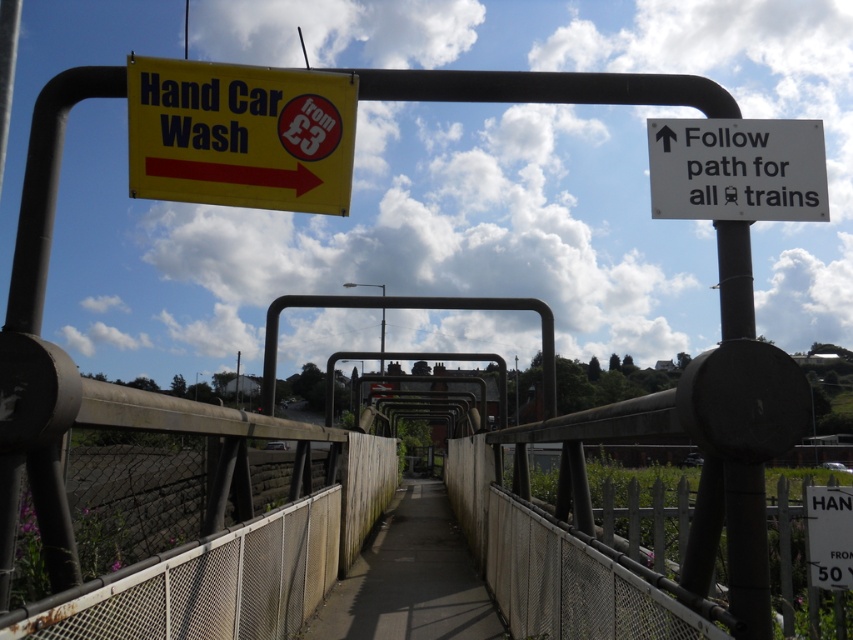
Question: Which object is positioned closest to the black metal pole at center?

Choices:
 (A) yellow plastic sign at upper left
 (B) white plastic sign at upper right
 (C) concrete sidewalk at center

Answer: (B)

Question: Is concrete sidewalk at center below black metal pole at center?

Choices:
 (A) yes
 (B) no

Answer: (A)

Question: Where is yellow plastic sign at upper left located in relation to black metal pole at center in the image?

Choices:
 (A) left
 (B) right

Answer: (A)

Question: Which object is farther from the camera taking this photo?

Choices:
 (A) concrete sidewalk at center
 (B) white plastic sign at upper right
 (C) black metal pole at center

Answer: (A)

Question: Can you confirm if yellow plastic sign at upper left is positioned to the left of white plastic sign at upper right?

Choices:
 (A) no
 (B) yes

Answer: (B)

Question: Which object appears closest to the camera in this image?

Choices:
 (A) concrete sidewalk at center
 (B) white plastic sign at upper right
 (C) black metal pole at center

Answer: (C)